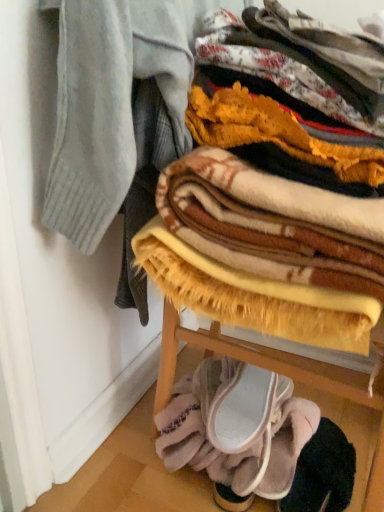
Where is `blank space situated above pink suede slipper at lower center, placed as the 2th footwear when sorted from bottom to top (from a real-world perspective)`? This screenshot has height=512, width=384. blank space situated above pink suede slipper at lower center, placed as the 2th footwear when sorted from bottom to top (from a real-world perspective) is located at coordinates (244, 392).